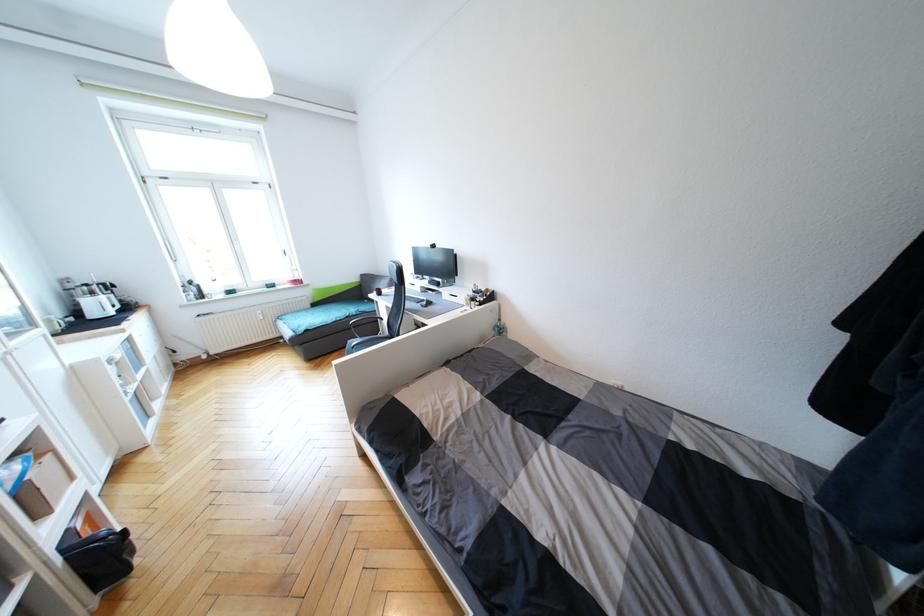
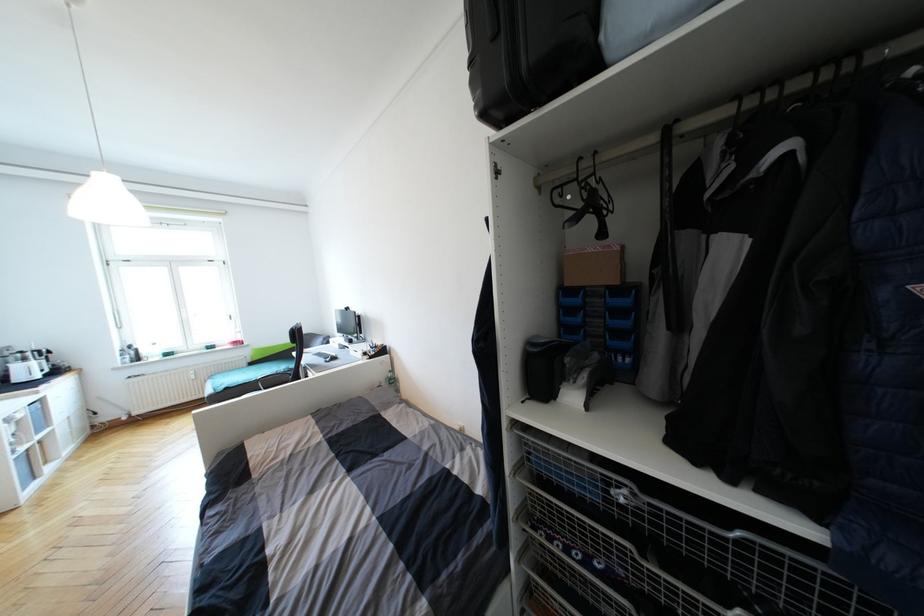
Find the pixel in the second image that matches point (504, 331) in the first image.

(395, 382)